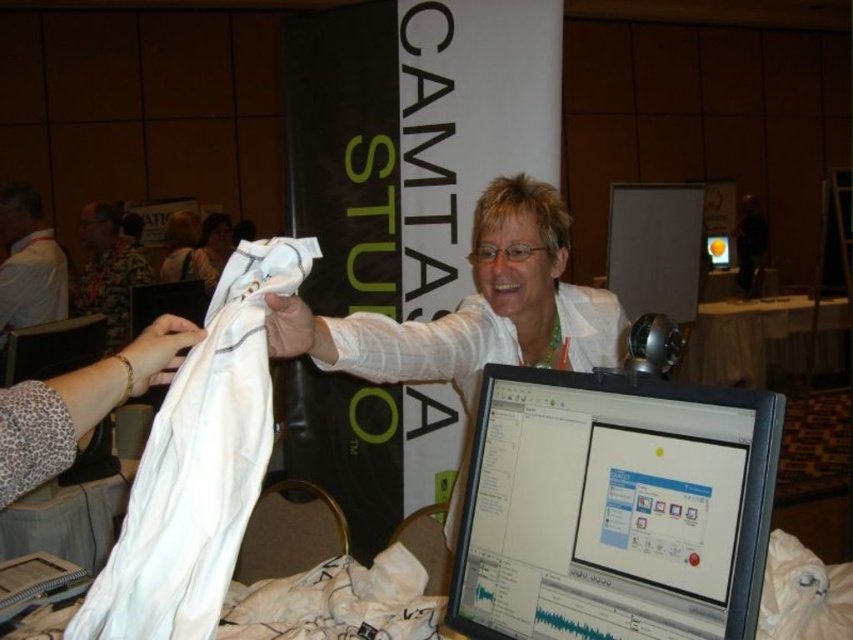
Question: Is white fabric at upper center positioned behind matte black monitor at center?

Choices:
 (A) no
 (B) yes

Answer: (A)

Question: Which object is farther from the camera taking this photo?

Choices:
 (A) matte black monitor at center
 (B) white cotton shirt at center
 (C) white fabric at lower left
 (D) matte black monitor at lower right

Answer: (A)

Question: Is white fabric at center below white fabric at upper center?

Choices:
 (A) yes
 (B) no

Answer: (A)

Question: Can you confirm if white matte shirt at center is smaller than white fabric at lower right?

Choices:
 (A) no
 (B) yes

Answer: (B)

Question: Which of the following is the closest to the observer?

Choices:
 (A) (761, 330)
 (B) (57, 436)
 (C) (138, 269)
 (D) (573, 493)

Answer: (B)

Question: Among these points, which one is farthest from the camera?

Choices:
 (A) (44, 278)
 (B) (172, 273)
 (C) (74, 310)
 (D) (19, 388)

Answer: (B)